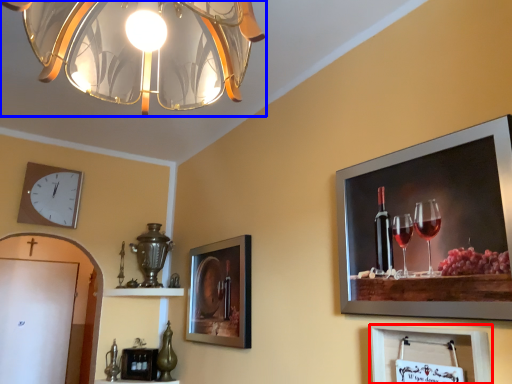
Question: Which of the following is the farthest to the observer, picture frame (highlighted by a red box) or lamp (highlighted by a blue box)?

Choices:
 (A) picture frame
 (B) lamp

Answer: (A)